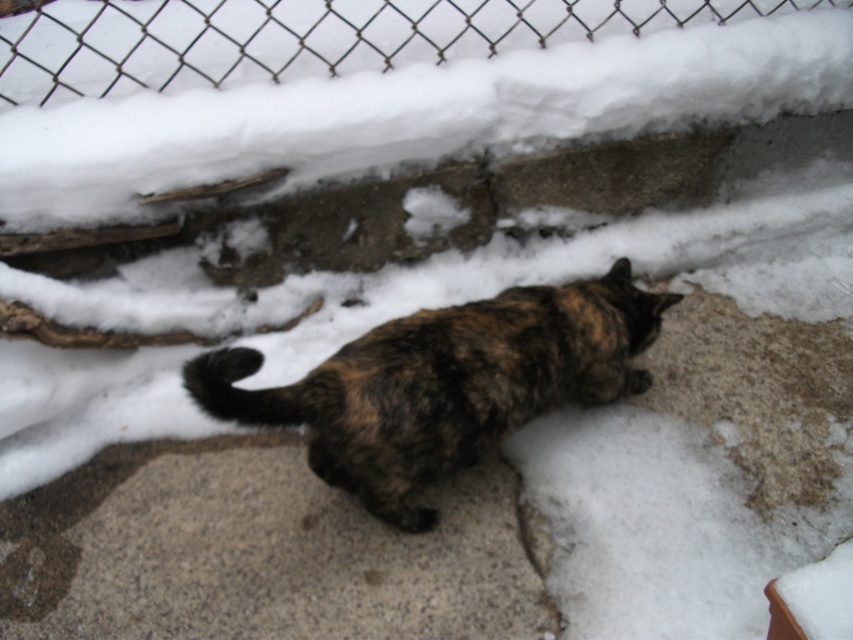
You are a delivery robot with a 1.2 meter reach. You need to place a package on the ground near the brown fur cat at center without getting too close to the wire mesh fence at upper center. Can you safely do this?

The brown fur cat at center is 1.16 meters away from the wire mesh fence at upper center. Since the robot has a 1.2 meter reach, it can extend its arm to place the package near the cat while maintaining a safe distance from the fence.

You are a photographer trying to capture the brown fur cat at center and the wire mesh fence at upper center in the same frame. Based on their sizes, which one should you focus on first to ensure both are in focus?

Since the brown fur cat at center is smaller than the wire mesh fence at upper center, you should focus on the brown fur cat at center first to ensure both are in focus.